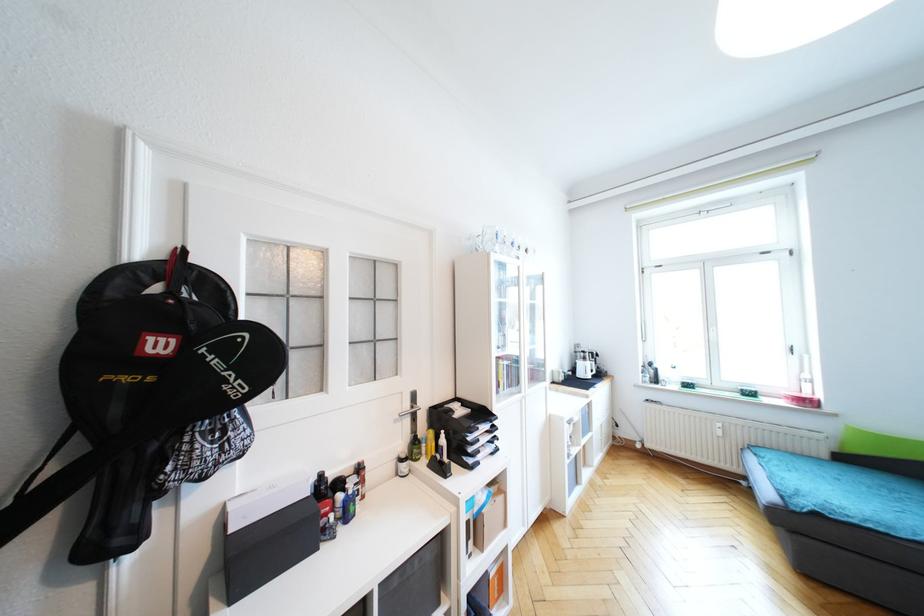
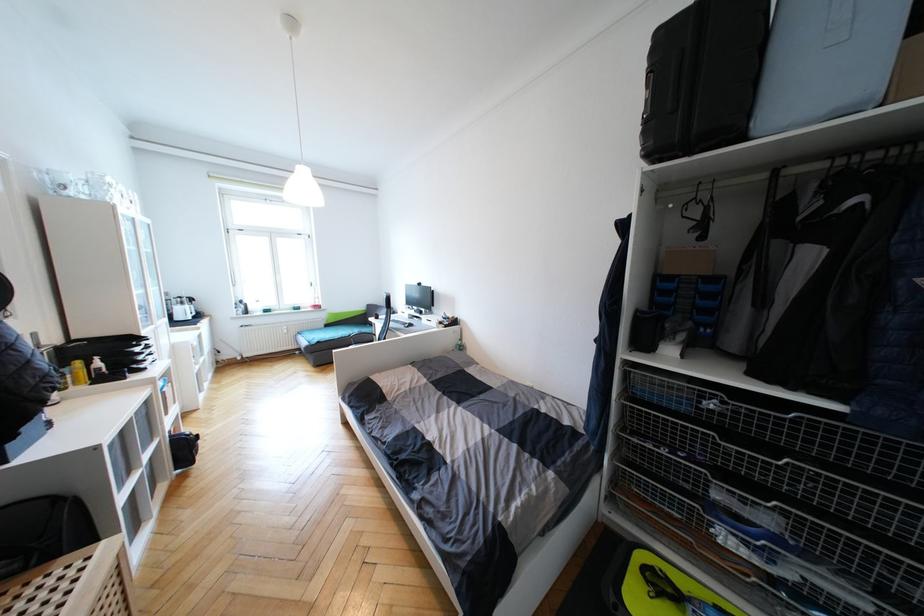
In the second image, find the point that corresponds to (x=588, y=360) in the first image.

(186, 305)